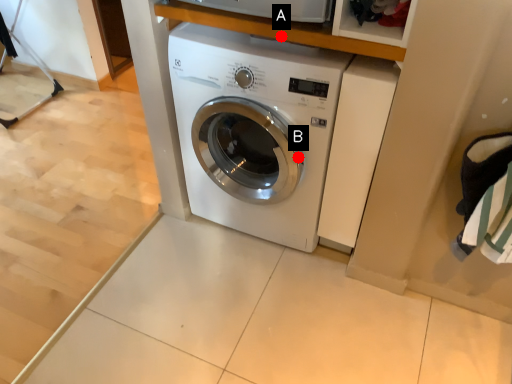
Question: Two points are circled on the image, labeled by A and B beside each circle. Which of the following is the farthest from the observer?

Choices:
 (A) A is further
 (B) B is further

Answer: (B)